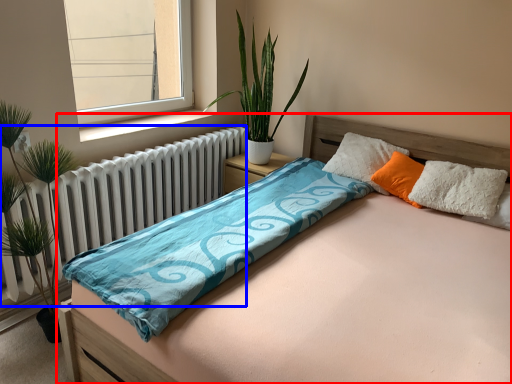
Question: Among these objects, which one is farthest to the camera, bed (highlighted by a red box) or radiator (highlighted by a blue box)?

Choices:
 (A) bed
 (B) radiator

Answer: (B)